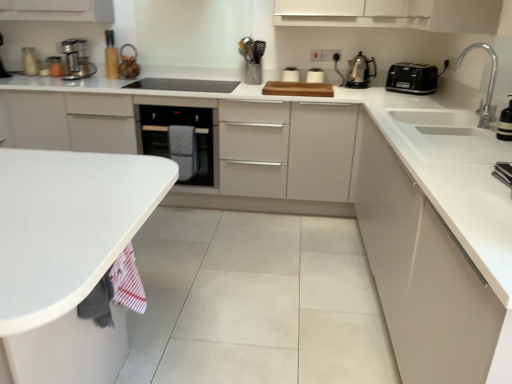
The image size is (512, 384). What are the coordinates of `free spot above white matte countertop at lower left (from a real-world perspective)` in the screenshot? It's located at (55, 194).